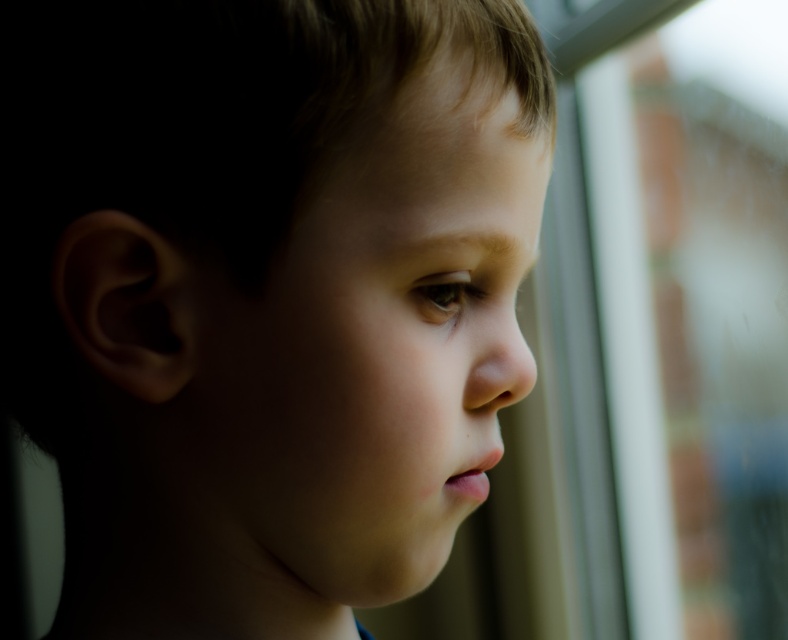
You are an artist trying to sketch the scene. The canvas is divided into a grid with coordinates from 0 to 1 in both x and y directions. You need to place the smooth skin child at upper center accurately. What are the exact coordinates where you should position the smooth skin child?

The smooth skin child at upper center should be positioned at coordinates approximately 0.461 in the x direction and 0.338 in the y direction.

You are a photographer adjusting your camera settings to capture the child in the scene. Since you want to ensure the smooth skin child at upper center is in focus while keeping the transparent glass window at right slightly blurred, which object should be positioned closer to the camera lens?

The smooth skin child at upper center should be positioned closer to the camera lens because it is closer to the viewer than the transparent glass window at right, allowing for selective focus on the child while blurring the background window.

You are a photographer adjusting the lighting for a portrait. You notice the smooth skin child at upper center and the transparent glass window at right in your frame. Which object is positioned farther to the left side of the image?

The smooth skin child at upper center is positioned farther to the left side of the image compared to the transparent glass window at right.